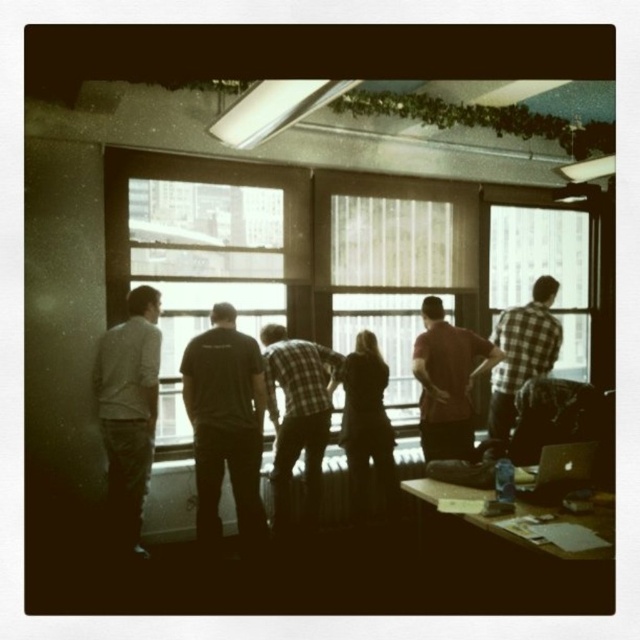
Consider the image. You are a new employee trying to reach the satin silver laptop at lower right to grab a document. However, there is a plaid fabric shirt at center blocking your path. Can you easily access the laptop without moving the shirt?

The satin silver laptop at lower right is behind the plaid fabric shirt at center, so you cannot easily access it without moving the shirt.

You are part of the group near the large windows. You need to hand a document to the person wearing the light gray shirt at left. Since you are standing near the clear glass window at center, can you directly hand them the document without moving past the window?

The light gray shirt at left is located below the clear glass window at center, so you can hand the document to them by reaching over the window since they are positioned lower than the window.

You are an office worker who needs to place a new 12cm tall document holder on your desk. Given the items already present, which object between the plaid fabric shirt at center and the satin silver laptop at lower right can the document holder be placed in front of without blocking the view of the other item?

The document holder can be placed in front of the satin silver laptop at lower right since the plaid fabric shirt at center is taller and would block the view of the laptop if placed in front of it.